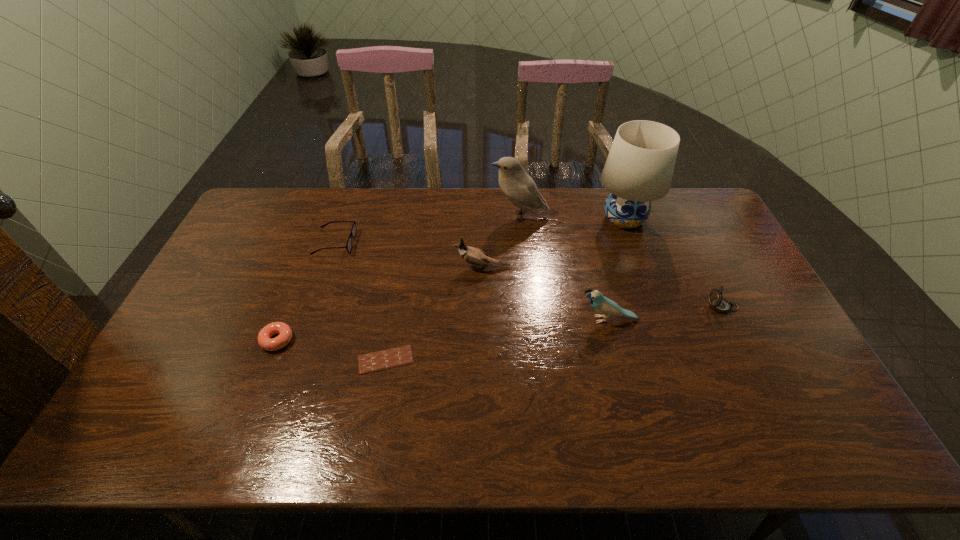
I want to click on object that is at the right edge, so click(719, 304).

Identify the location of free point at the far edge. (560, 223).

This screenshot has width=960, height=540. Identify the location of vacant space at the near edge of the desktop. (603, 440).

Identify the location of free space at the left edge. The image size is (960, 540). (267, 242).

The width and height of the screenshot is (960, 540). In the image, there is a desktop. In order to click on blank space at the right edge in this screenshot , I will do `click(745, 326)`.

At what (x,y) coordinates should I click in order to perform the action: click on free space at the far left corner of the desktop. Please return your answer as a coordinate pair (x, y). Looking at the image, I should click on (285, 202).

The width and height of the screenshot is (960, 540). What are the coordinates of `free space at the near right corner of the desktop` in the screenshot? It's located at (815, 425).

This screenshot has width=960, height=540. I want to click on unoccupied position between the spectacles and the lampshade, so pyautogui.click(x=479, y=231).

Locate an element on the screen. vacant area that lies between the chocolate bar and the seventh tallest object is located at coordinates (331, 350).

At what (x,y) coordinates should I click in order to perform the action: click on free space between the spectacles and the sixth object from right to left. Please return your answer as a coordinate pair (x, y). Looking at the image, I should click on (360, 301).